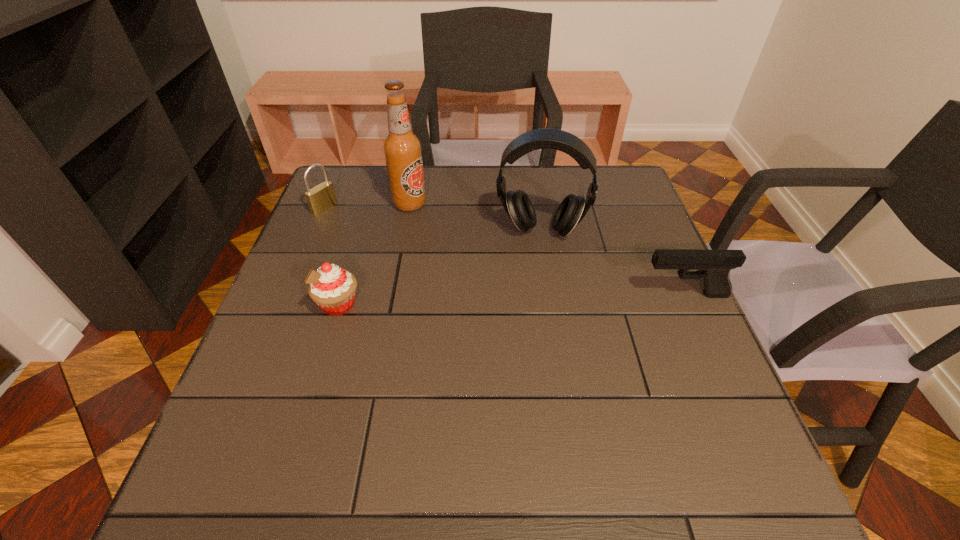
This screenshot has width=960, height=540. Find the location of `the fourth object from right to left`. the fourth object from right to left is located at coordinates (331, 287).

Where is `the rightmost object`? the rightmost object is located at coordinates (714, 266).

The width and height of the screenshot is (960, 540). In order to click on the third object from right to left in this screenshot , I will do `click(402, 148)`.

This screenshot has width=960, height=540. I want to click on beer bottle, so click(x=402, y=148).

Locate an element on the screen. earphone is located at coordinates (518, 206).

Locate an element on the screen. The image size is (960, 540). the second tallest object is located at coordinates (518, 206).

Image resolution: width=960 pixels, height=540 pixels. What are the coordinates of `the leftmost object` in the screenshot? It's located at (322, 197).

What are the coordinates of `free region located on the front of the second object from left to right` in the screenshot? It's located at (325, 349).

At what (x,y) coordinates should I click in order to perform the action: click on free space located 0.310m on the front-facing side of the pistol. Please return your answer as a coordinate pair (x, y). This screenshot has width=960, height=540. Looking at the image, I should click on (504, 295).

The image size is (960, 540). What are the coordinates of `vacant space located on the front-facing side of the pistol` in the screenshot? It's located at (535, 295).